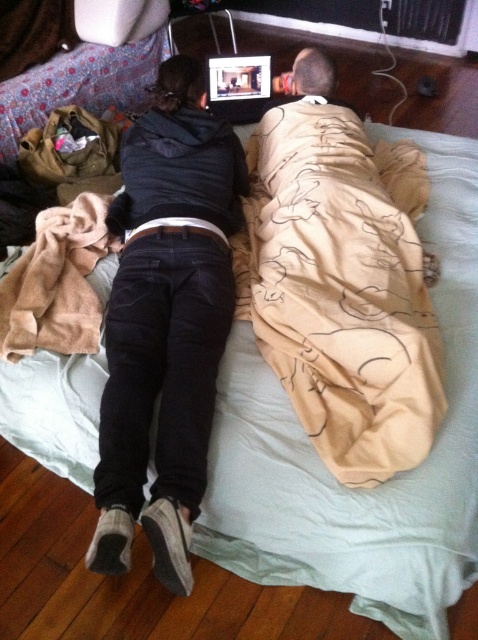
Looking at the scene, where is the beige cotton blanket at upper right in relation to the black corduroy pants at center?

The beige cotton blanket at upper right is located to the right of the black corduroy pants at center.

You are a photographer positioned at the center of the room. You want to take a photo of the beige cotton blanket at upper right. According to the coordinates provided, in which direction should you move to get the best shot?

The beige cotton blanket at upper right is located at coordinates 0.442 on the x axis and 0.718 on the y axis. Since you are at the center, moving towards the upper right direction will align your camera with the blanket.

You are packing a small backpack for a short trip and need to decide which item to take between the beige cotton blanket at upper right and the black corduroy pants at center. Based on their sizes, which one would you choose if you want to prioritize space efficiency?

The black corduroy pants at center are smaller in size compared to the beige cotton blanket at upper right, so you should choose the black corduroy pants at center to prioritize space efficiency.